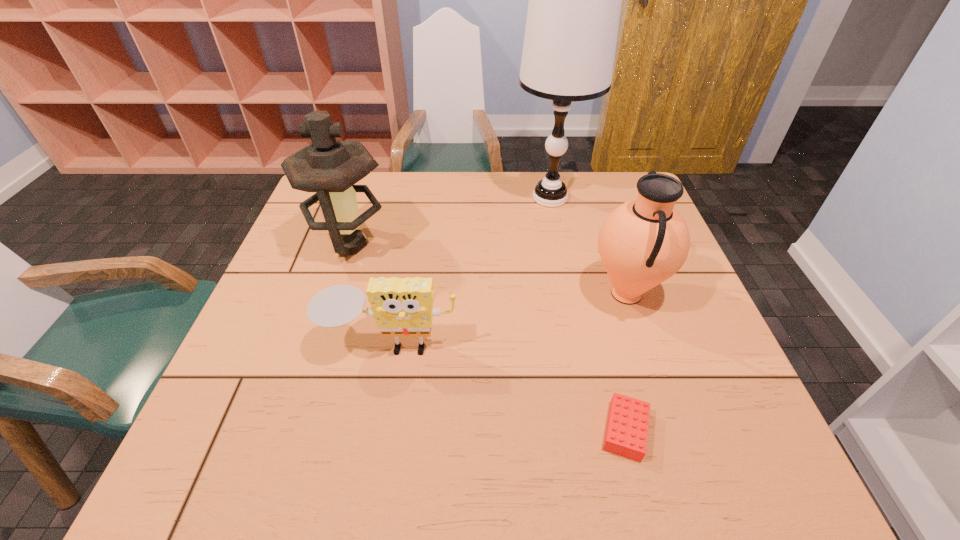
The width and height of the screenshot is (960, 540). Find the location of `vacant area that lies between the sponge and the table lamp`. vacant area that lies between the sponge and the table lamp is located at coordinates (470, 272).

Locate an element on the screen. free space between the Lego and the oil lamp is located at coordinates (488, 338).

Locate an element on the screen. The image size is (960, 540). unoccupied position between the nearest object and the third tallest object is located at coordinates (626, 362).

Image resolution: width=960 pixels, height=540 pixels. I want to click on blank region between the third shortest object and the nearest object, so click(626, 362).

The image size is (960, 540). Find the location of `object that is the second closest to the farthest object`. object that is the second closest to the farthest object is located at coordinates (330, 167).

Locate an element on the screen. This screenshot has width=960, height=540. object that is the second closest to the farthest object is located at coordinates (330, 167).

At what (x,y) coordinates should I click in order to perform the action: click on free space in the image that satisfies the following two spatial constraints: 1. on the front side of the nearest object; 2. on the left side of the farthest object. Please return your answer as a coordinate pair (x, y). Looking at the image, I should click on (597, 430).

Find the location of a particular element. free space that satisfies the following two spatial constraints: 1. on the front-facing side of the second shortest object; 2. on the right side of the Lego is located at coordinates (375, 430).